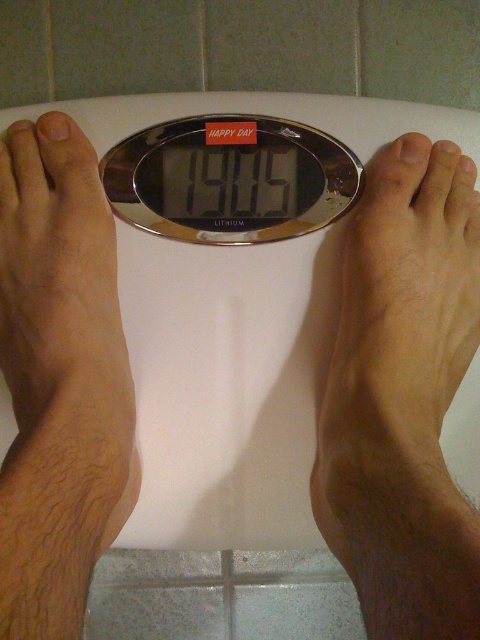
Question: Is smooth skin foot at left positioned in front of silver metallic scale at center?

Choices:
 (A) no
 (B) yes

Answer: (B)

Question: Which object appears farthest from the camera in this image?

Choices:
 (A) silver metallic scale at center
 (B) smooth skin foot at left

Answer: (A)

Question: Which of the following is the farthest from the observer?

Choices:
 (A) smooth skin foot at left
 (B) silver metallic scale at center

Answer: (B)

Question: Which of the following is the farthest from the observer?

Choices:
 (A) (115, 496)
 (B) (225, 198)

Answer: (B)

Question: Can you confirm if smooth skin foot at left is positioned to the left of silver metallic scale at center?

Choices:
 (A) yes
 (B) no

Answer: (A)

Question: Considering the relative positions of smooth skin foot at left and silver metallic scale at center in the image provided, where is smooth skin foot at left located with respect to silver metallic scale at center?

Choices:
 (A) above
 (B) below

Answer: (B)